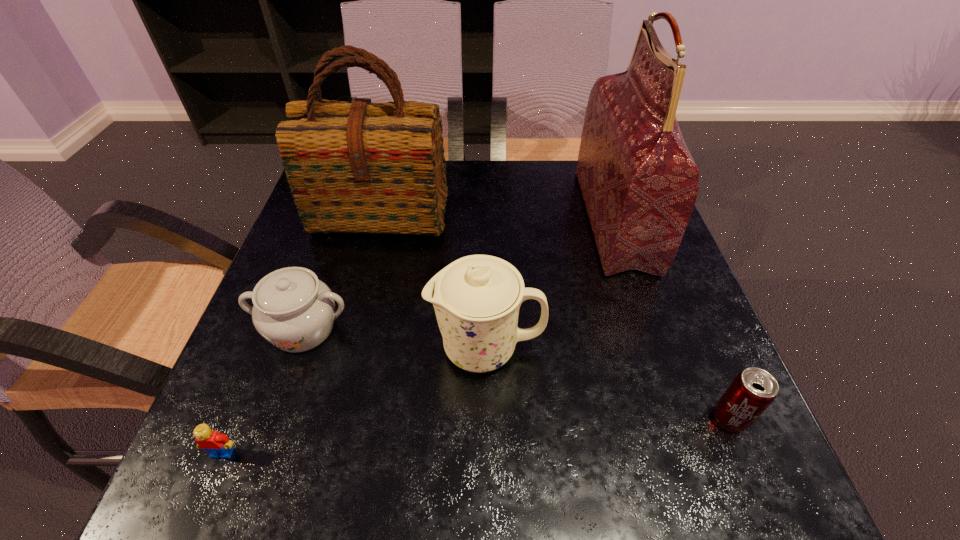
Locate an element on the screen. This screenshot has height=540, width=960. free spot between the Lego and the fifth farthest object is located at coordinates (476, 435).

Locate an element on the screen. This screenshot has width=960, height=540. vacant point located between the third shortest object and the fourth shortest object is located at coordinates pos(395,339).

Locate which object is the fifth closest to the fifth farthest object. Please provide its 2D coordinates. Your answer should be formatted as a tuple, i.e. [(x, y)], where the tuple contains the x and y coordinates of a point satisfying the conditions above.

[(217, 444)]

Where is `the fifth closest object to the fourth tallest object`? This screenshot has height=540, width=960. the fifth closest object to the fourth tallest object is located at coordinates (752, 391).

At what (x,y) coordinates should I click in order to perform the action: click on vacant space that satisfies the following two spatial constraints: 1. on the spout of the second nearest object; 2. on the right side of the right chinaware. Please return your answer as a coordinate pair (x, y). The width and height of the screenshot is (960, 540). Looking at the image, I should click on (487, 417).

Identify the location of free spot that satisfies the following two spatial constraints: 1. on the spout of the taller chinaware; 2. on the face of the shortest object. Image resolution: width=960 pixels, height=540 pixels. click(x=487, y=453).

Find the location of a particular element. This screenshot has width=960, height=540. free location that satisfies the following two spatial constraints: 1. on the front-facing side of the handbag; 2. on the face of the Lego is located at coordinates (692, 453).

At what (x,y) coordinates should I click in order to perform the action: click on free region that satisfies the following two spatial constraints: 1. on the front-facing side of the beer can; 2. on the left side of the handbag. Please return your answer as a coordinate pair (x, y). Looking at the image, I should click on (681, 417).